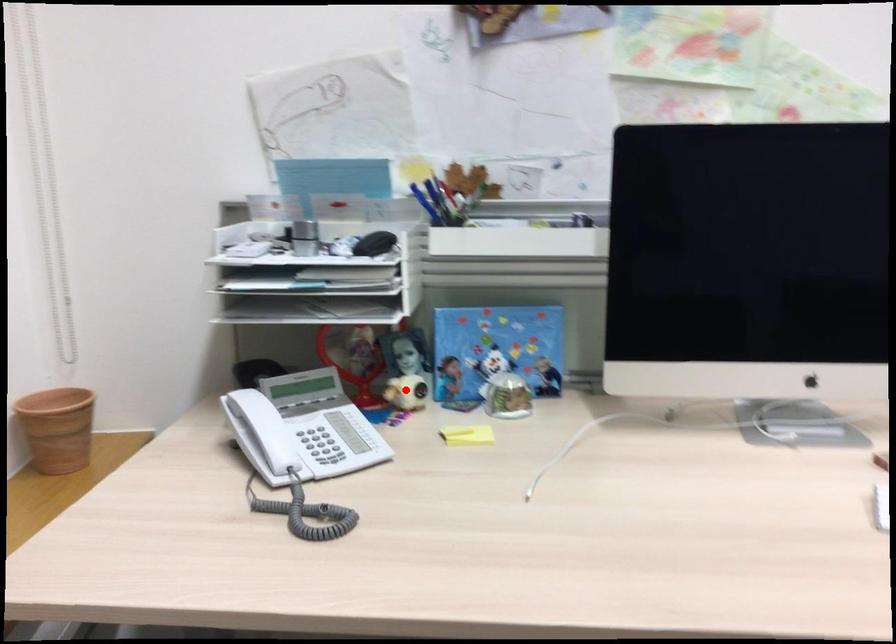
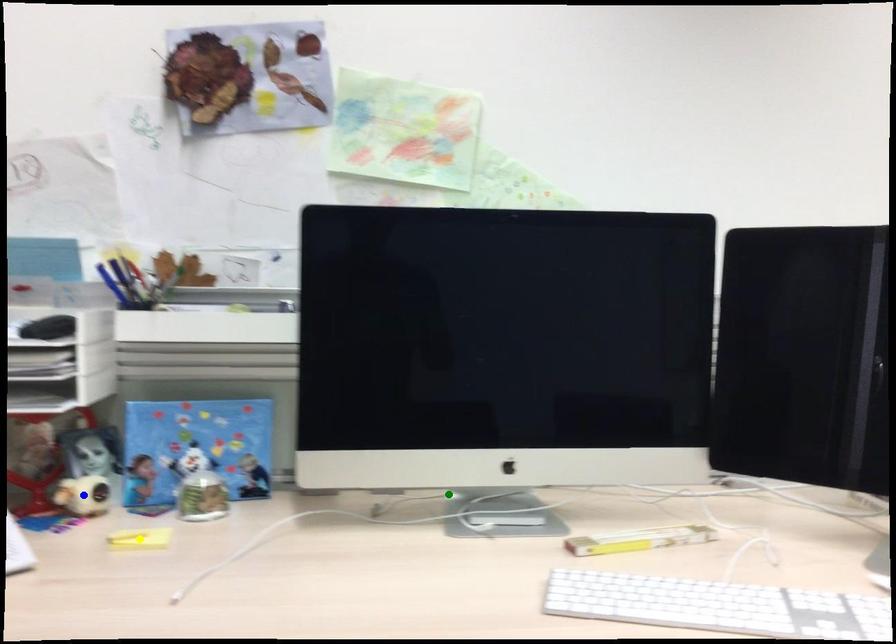
Question: I am providing you with two images of the same scene from different viewpoints. A red point is marked on the first image. You are given multiple points on the second image. Which mark in image 2 goes with the point in image 1?

Choices:
 (A) yellow point
 (B) green point
 (C) blue point

Answer: (C)